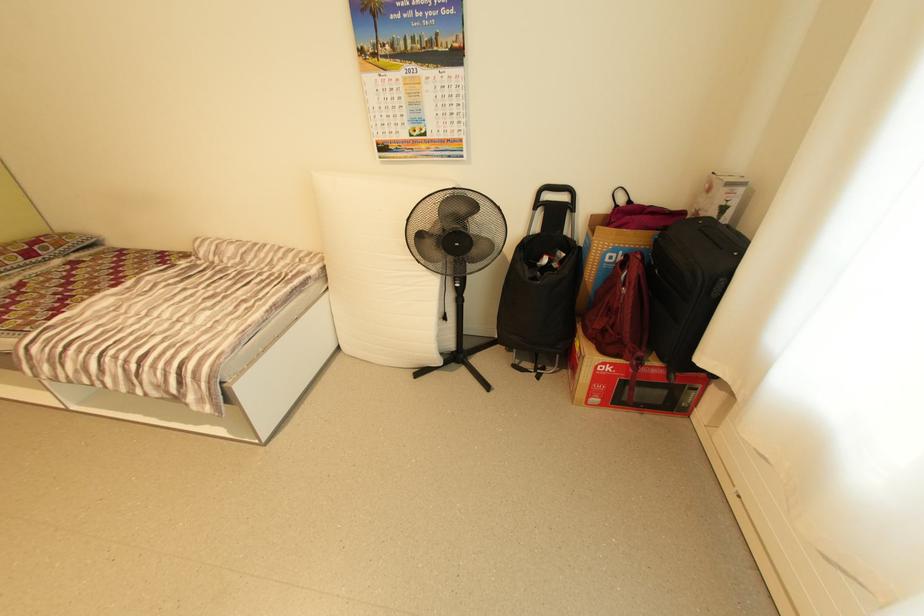
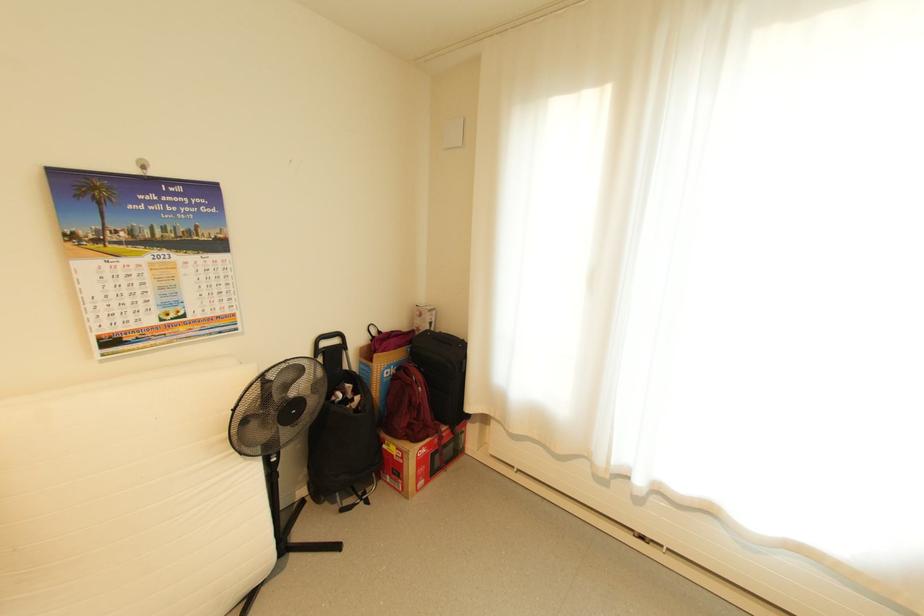
In the second image, find the point that corresponds to point (570, 198) in the first image.

(342, 342)